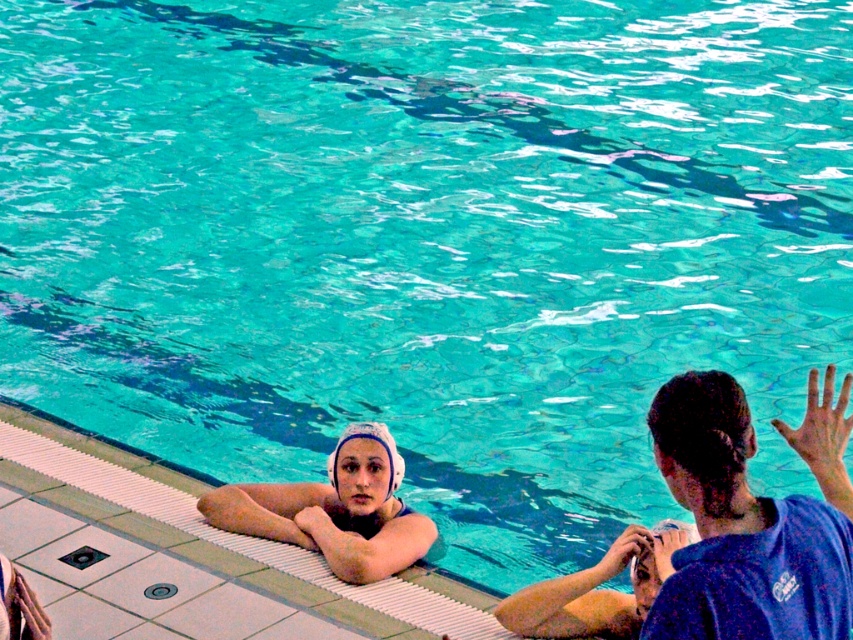
You are a photographer taking a picture of the pool scene. You notice the blue cotton shirt at upper right and the white matte swim cap at upper center. Which object is positioned higher in the image?

The blue cotton shirt at upper right is positioned higher in the image than the white matte swim cap at upper center.

You are a lifeguard standing at the edge of the pool. You need to quickly reach either the blue cotton shirt at upper right or the white matte swim cap at upper center in case of an emergency. Which one is closer to you?

The white matte swim cap at upper center is closer to you because it is only 3.35 meters away from the blue cotton shirt at upper right, but since you are at the pool edge, the swim cap is likely positioned closer than the shirt which is further away.

You are a photographer at the poolside. You need to capture a photo where both the blue cotton shirt at upper right and the white matte swim cap at upper center are visible. Which object should you focus on first to ensure both are in frame?

The blue cotton shirt at upper right is smaller than the white matte swim cap at upper center. To ensure both are in frame, focus on the larger object first, which is the white matte swim cap at upper center, then adjust to include the smaller blue cotton shirt at upper right.